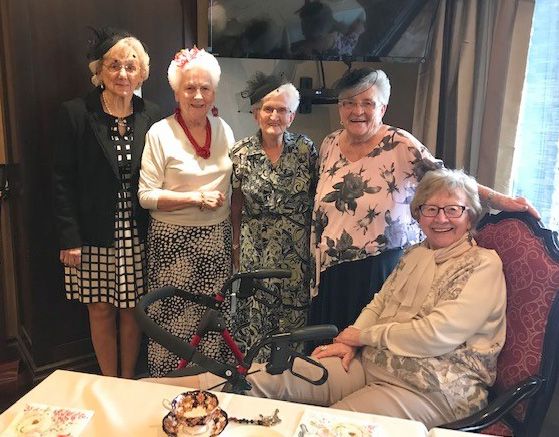
This screenshot has height=437, width=559. Find the location of `napkins`. napkins is located at coordinates (61, 420), (383, 435).